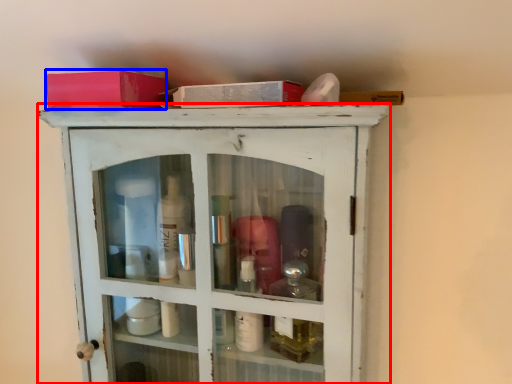
Question: Which of the following is the farthest to the observer, cupboard (highlighted by a red box) or box (highlighted by a blue box)?

Choices:
 (A) cupboard
 (B) box

Answer: (B)